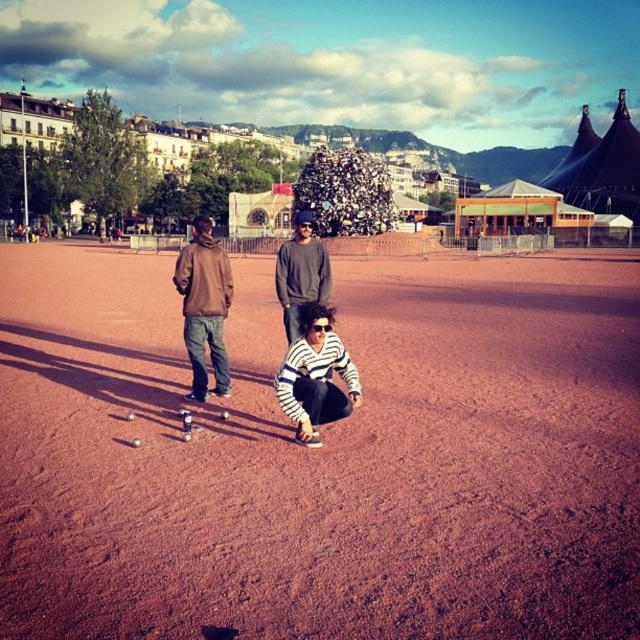
Locate an element on the screen. The width and height of the screenshot is (640, 640). brown dirt field at center is located at coordinates (321, 456).

Consider the image. Does striped fabric at center appear over gray sweater at center?

No.

Consider the image. Does striped fabric at center appear under gray sweater at center?

Correct, striped fabric at center is located below gray sweater at center.

The image size is (640, 640). What are the coordinates of `striped fabric at center` in the screenshot? It's located at (316, 376).

Which is behind, point (369, 508) or point (198, 378)?

Positioned behind is point (198, 378).

Can you confirm if brown dirt field at center is shorter than brown matte jacket at left?

In fact, brown dirt field at center may be taller than brown matte jacket at left.

Is point (125, 483) behind point (196, 392)?

That is False.

Where is `brown dirt field at center`? The height and width of the screenshot is (640, 640). brown dirt field at center is located at coordinates (321, 456).